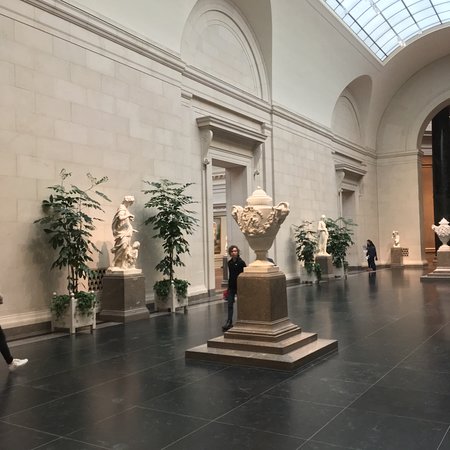
You are a GUI agent. You are given a task and a screenshot of the screen. Output one action in this format:
    pyautogui.click(x=<x>, y=<y>)
    Task: Click on the archway
    The height and width of the screenshot is (450, 450).
    Given the screenshot: What is the action you would take?
    pyautogui.click(x=441, y=102)